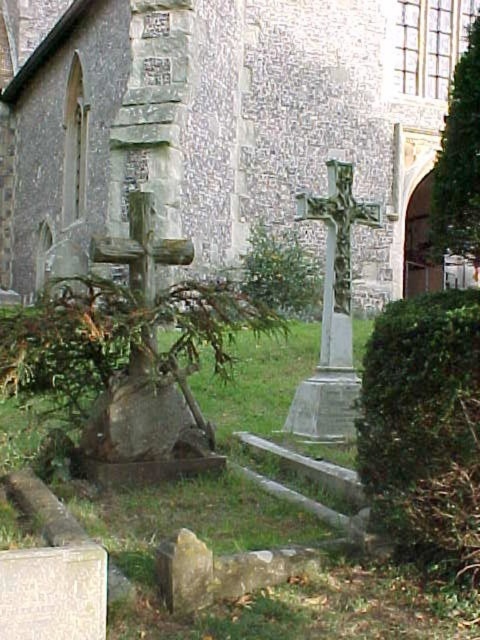
Question: Is stone church at center in front of green leafy tree at upper right?

Choices:
 (A) no
 (B) yes

Answer: (A)

Question: Which point is closer to the camera taking this photo?

Choices:
 (A) click(x=456, y=170)
 (B) click(x=157, y=211)

Answer: (A)

Question: From the image, what is the correct spatial relationship of stone church at center in relation to green leafy tree at upper right?

Choices:
 (A) below
 (B) above

Answer: (B)

Question: Is stone church at center thinner than green leafy tree at upper right?

Choices:
 (A) no
 (B) yes

Answer: (A)

Question: Among these objects, which one is nearest to the camera?

Choices:
 (A) green leafy tree at upper right
 (B) stone church at center

Answer: (A)